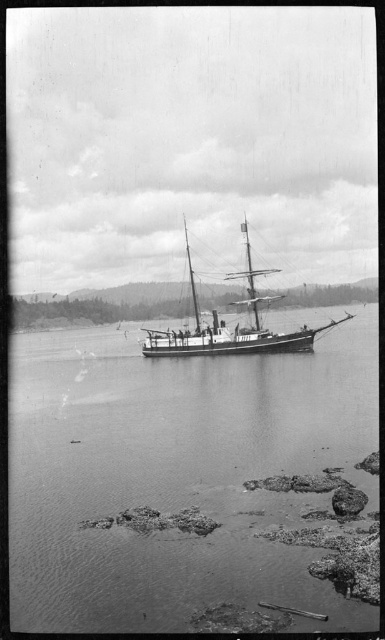
Question: Does smooth water at center have a lesser width compared to wooden ship at center?

Choices:
 (A) yes
 (B) no

Answer: (B)

Question: Which of the following is the farthest from the observer?

Choices:
 (A) (306, 342)
 (B) (353, 336)

Answer: (B)

Question: Which point appears farthest from the camera in this image?

Choices:
 (A) (291, 324)
 (B) (224, 333)

Answer: (A)

Question: Is smooth water at center to the left of wooden ship at center from the viewer's perspective?

Choices:
 (A) yes
 (B) no

Answer: (B)

Question: Does smooth water at center have a greater width compared to wooden ship at center?

Choices:
 (A) no
 (B) yes

Answer: (B)